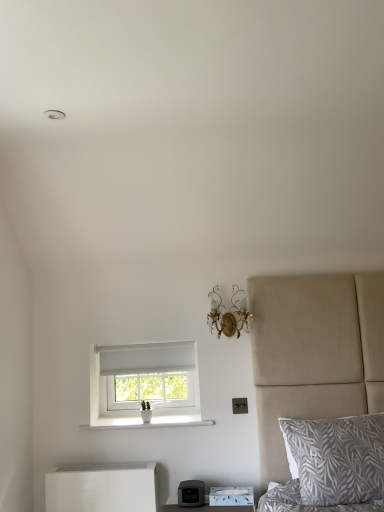
Question: Considering the relative sizes of white matte nightstand at lower left and white ceramic vase at lower center in the image provided, is white matte nightstand at lower left shorter than white ceramic vase at lower center?

Choices:
 (A) yes
 (B) no

Answer: (B)

Question: From a real-world perspective, does white matte nightstand at lower left stand above white ceramic vase at lower center?

Choices:
 (A) yes
 (B) no

Answer: (B)

Question: Can you confirm if white matte nightstand at lower left is positioned to the right of white ceramic vase at lower center?

Choices:
 (A) no
 (B) yes

Answer: (A)

Question: Does white matte nightstand at lower left have a greater width compared to white ceramic vase at lower center?

Choices:
 (A) no
 (B) yes

Answer: (A)

Question: Is white matte nightstand at lower left positioned beyond the bounds of white ceramic vase at lower center?

Choices:
 (A) no
 (B) yes

Answer: (B)

Question: Considering the relative positions of white matte nightstand at lower left and white ceramic vase at lower center in the image provided, is white matte nightstand at lower left to the left of white ceramic vase at lower center from the viewer's perspective?

Choices:
 (A) yes
 (B) no

Answer: (A)

Question: Is white fabric window at center oriented towards gray leaf-patterned pillow at lower right?

Choices:
 (A) yes
 (B) no

Answer: (B)

Question: Does white fabric window at center have a lesser width compared to gray leaf-patterned pillow at lower right?

Choices:
 (A) yes
 (B) no

Answer: (A)

Question: Is white fabric window at center at the left side of gray leaf-patterned pillow at lower right?

Choices:
 (A) no
 (B) yes

Answer: (B)

Question: From a real-world perspective, is white fabric window at center positioned over gray leaf-patterned pillow at lower right based on gravity?

Choices:
 (A) no
 (B) yes

Answer: (B)

Question: Considering the relative positions of white fabric window at center and gray leaf-patterned pillow at lower right in the image provided, is white fabric window at center behind gray leaf-patterned pillow at lower right?

Choices:
 (A) no
 (B) yes

Answer: (B)

Question: From the image's perspective, is white fabric window at center on top of gray leaf-patterned pillow at lower right?

Choices:
 (A) yes
 (B) no

Answer: (A)

Question: From the image's perspective, is gray leaf-patterned pillow at lower right above gold crystal sconce at upper center?

Choices:
 (A) no
 (B) yes

Answer: (A)